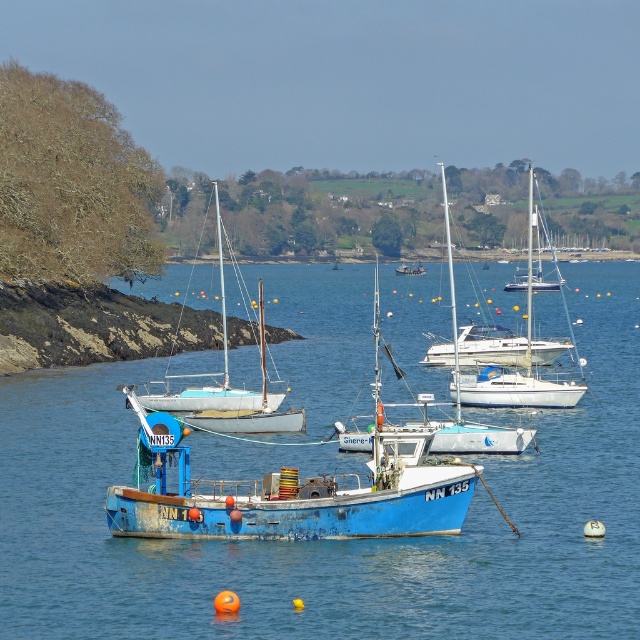
Does point (614, 588) come farther from viewer compared to point (221, 390)?

That is False.

Can you confirm if blue painted water at center is thinner than white matte sailboat at center?

In fact, blue painted water at center might be wider than white matte sailboat at center.

Which is behind, point (637, 390) or point (234, 401)?

The point (637, 390) is behind.

Where is `blue painted water at center`? blue painted water at center is located at coordinates (333, 540).

Between white matte sailboat at center and blue painted wooden sailboat at center, which one appears on the right side from the viewer's perspective?

blue painted wooden sailboat at center

The image size is (640, 640). Find the location of `white matte sailboat at center`. white matte sailboat at center is located at coordinates (216, 374).

I want to click on white matte sailboat at center, so click(x=216, y=374).

Find the location of a particular element. blue painted water at center is located at coordinates (333, 540).